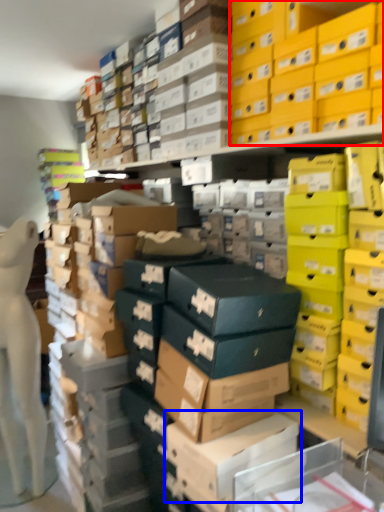
Question: Which of the following is the closest to the observer, storage box (highlighted by a red box) or cardboard box (highlighted by a blue box)?

Choices:
 (A) storage box
 (B) cardboard box

Answer: (B)